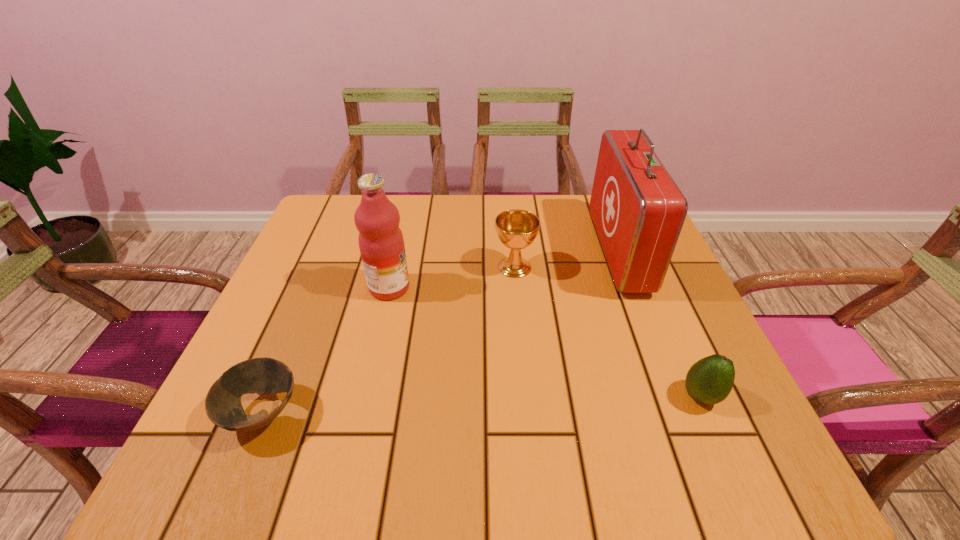
Image resolution: width=960 pixels, height=540 pixels. I want to click on the first-aid kit, so click(x=638, y=211).

At what (x,y) coordinates should I click in order to perform the action: click on the fourth object from right to left. Please return your answer as a coordinate pair (x, y). Looking at the image, I should click on (381, 243).

Identify the location of the third shortest object. Image resolution: width=960 pixels, height=540 pixels. (517, 229).

Find the location of a particular element. The image size is (960, 540). chalice is located at coordinates (517, 229).

Where is `avocado`? This screenshot has height=540, width=960. avocado is located at coordinates (709, 381).

Identify the location of the leftmost object. The image size is (960, 540). (223, 406).

Locate an element on the screen. This screenshot has height=540, width=960. the shortest object is located at coordinates (223, 406).

Where is `free space located on the side of the first-aid kit with the first aid cross symbol`? The height and width of the screenshot is (540, 960). free space located on the side of the first-aid kit with the first aid cross symbol is located at coordinates (492, 251).

In order to click on free spot located 0.190m on the side of the first-aid kit with the first aid cross symbol in this screenshot , I will do `click(524, 251)`.

Where is `blank area located 0.290m on the side of the first-aid kit with the first aid cross symbol`? This screenshot has width=960, height=540. blank area located 0.290m on the side of the first-aid kit with the first aid cross symbol is located at coordinates (485, 251).